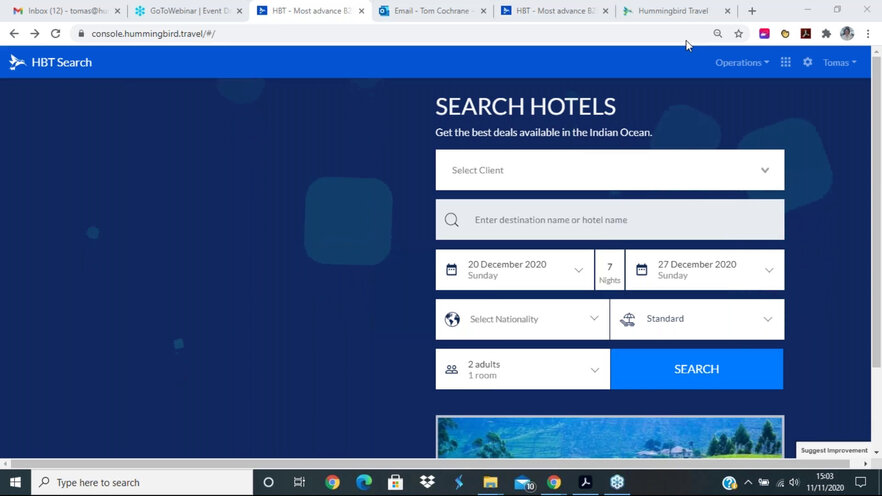
Locate an element on the screen. Image resolution: width=882 pixels, height=496 pixels. calendar is located at coordinates (639, 268).